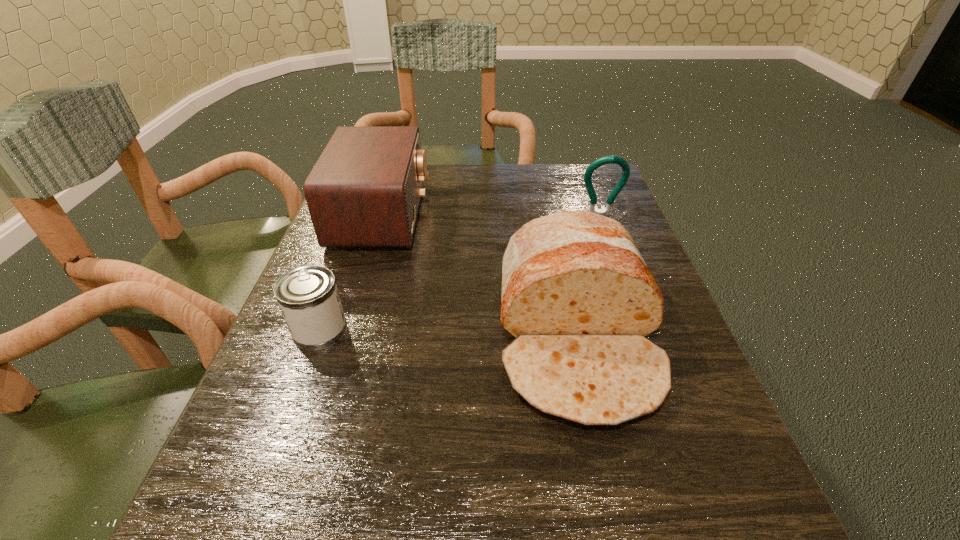
At what (x,y) coordinates should I click in order to perform the action: click on free spot between the shortest object and the bottle opener. Please return your answer as a coordinate pair (x, y). The width and height of the screenshot is (960, 540). Looking at the image, I should click on pos(460,273).

Find the location of a particular element. The image size is (960, 540). free spot between the bottle opener and the shortest object is located at coordinates (460, 273).

Where is `vacant area between the bottle opener and the radio receiver`? The width and height of the screenshot is (960, 540). vacant area between the bottle opener and the radio receiver is located at coordinates (491, 215).

At what (x,y) coordinates should I click in order to perform the action: click on free space between the bread and the radio receiver. Please return your answer as a coordinate pair (x, y). This screenshot has width=960, height=540. Looking at the image, I should click on coord(479,276).

Find the location of a particular element. free space between the bottle opener and the radio receiver is located at coordinates (491, 215).

At what (x,y) coordinates should I click in order to perform the action: click on free space between the bread and the can. Please return your answer as a coordinate pair (x, y). Looking at the image, I should click on point(448,334).

Where is `the third closest object to the can`? This screenshot has width=960, height=540. the third closest object to the can is located at coordinates (620, 161).

Locate which object is the third closest to the bread. Please provide its 2D coordinates. Your answer should be formatted as a tuple, i.e. [(x, y)], where the tuple contains the x and y coordinates of a point satisfying the conditions above.

[(308, 297)]